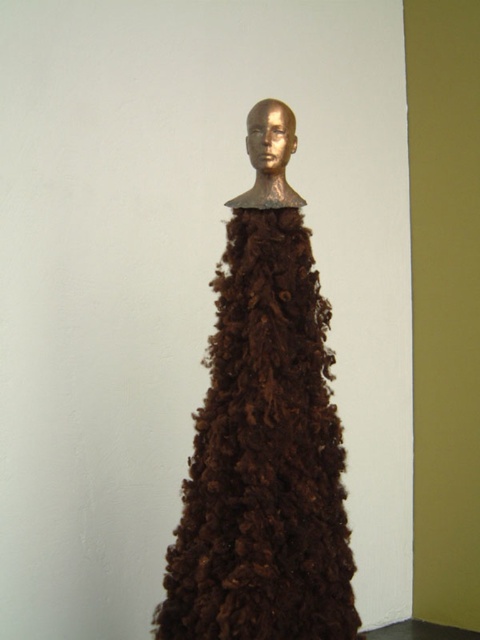
You are an art critic standing in front of the sculpture. You notice the brown fluffy dress at center and the gold metallic head at center. Which part of the sculpture do you see first when looking directly at the sculpture?

The brown fluffy dress at center is closer to the viewer than the gold metallic head at center, so you would see the brown fluffy dress at center first when looking directly at the sculpture.